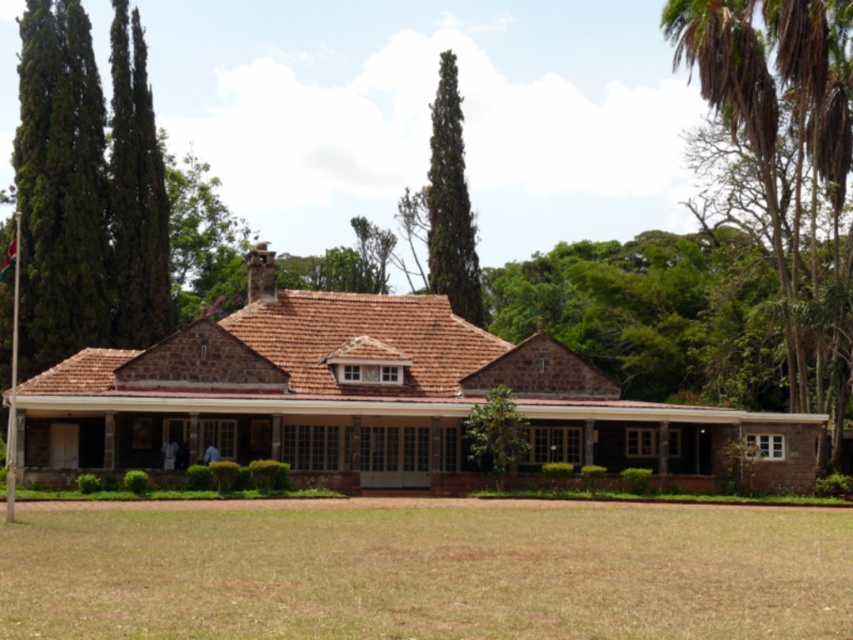
Consider the image. Between brown stone porch at center and green textured cypress at upper center, which one appears on the right side from the viewer's perspective?

green textured cypress at upper center

Does brown stone porch at center have a lesser height compared to green textured cypress at upper center?

Indeed, brown stone porch at center has a lesser height compared to green textured cypress at upper center.

Who is more forward, [550,406] or [434,157]?

Positioned in front is point [550,406].

The width and height of the screenshot is (853, 640). Find the location of `brown stone porch at center`. brown stone porch at center is located at coordinates (242, 433).

Which is below, brown grass at lower center or brown stone porch at center?

brown grass at lower center is below.

Who is taller, brown grass at lower center or brown stone porch at center?

brown stone porch at center is taller.

Locate an element on the screen. brown grass at lower center is located at coordinates (428, 573).

Does point (634, 612) come in front of point (16, 376)?

Yes.

Is point (172, 544) behind point (10, 458)?

No.

You are a GUI agent. You are given a task and a screenshot of the screen. Output one action in this format:
    pyautogui.click(x=<x>, y=<y>)
    Task: Click on the brown grass at lower center
    The height and width of the screenshot is (640, 853).
    Given the screenshot: What is the action you would take?
    pyautogui.click(x=428, y=573)

Locate an element on the screen. brown grass at lower center is located at coordinates (428, 573).